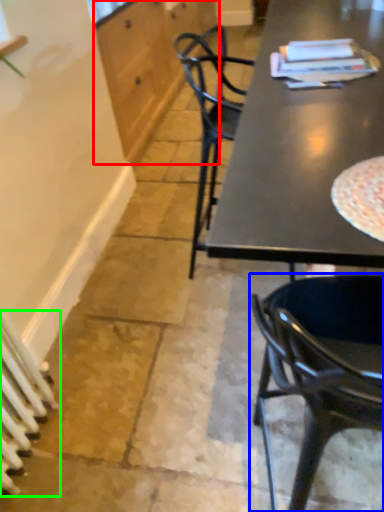
Question: Which is farther away from cabinetry (highlighted by a red box)? chair (highlighted by a blue box) or radiator (highlighted by a green box)?

Choices:
 (A) chair
 (B) radiator

Answer: (A)